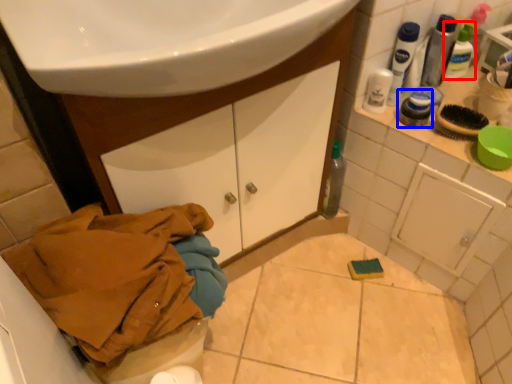
Question: Which of the following is the closest to the observer, mouthwash (highlighted by a red box) or toiletry (highlighted by a blue box)?

Choices:
 (A) mouthwash
 (B) toiletry

Answer: (B)